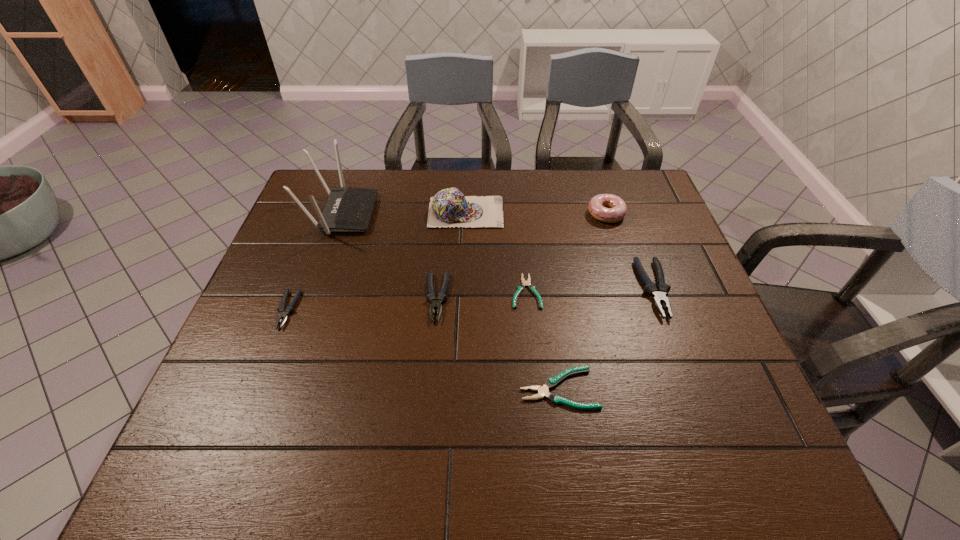
Identify the location of unoccupied area between the third tallest object and the bigger teal pliers. This screenshot has height=540, width=960. (583, 301).

You are a GUI agent. You are given a task and a screenshot of the screen. Output one action in this format:
    pyautogui.click(x=<x>, y=<y>)
    Task: Click on the free space between the router and the leftmost pliers
    The height and width of the screenshot is (540, 960).
    Given the screenshot: What is the action you would take?
    pyautogui.click(x=315, y=262)

Identify the location of unoccupied area between the shortest object and the fourth tallest pliers. The height and width of the screenshot is (540, 960). (542, 340).

This screenshot has height=540, width=960. In order to click on free area in between the rightmost pliers and the doughnut in this screenshot , I will do `click(630, 251)`.

Locate an element on the screen. free space between the rightmost gray pliers and the sixth shortest object is located at coordinates (630, 251).

This screenshot has height=540, width=960. In order to click on object that stands as the fourth closest to the shortest pliers in this screenshot , I will do `click(659, 293)`.

Locate an element on the screen. the seventh closest object to the doughnut is located at coordinates (284, 313).

Where is `pliers object that ranks as the fourth closest to the router`? The image size is (960, 540). pliers object that ranks as the fourth closest to the router is located at coordinates (543, 391).

Locate an element on the screen. the third closest pliers relative to the second gray pliers from right to left is located at coordinates (284, 313).

Locate an element on the screen. The image size is (960, 540). gray pliers object that ranks as the second closest to the second pliers from left to right is located at coordinates (659, 293).